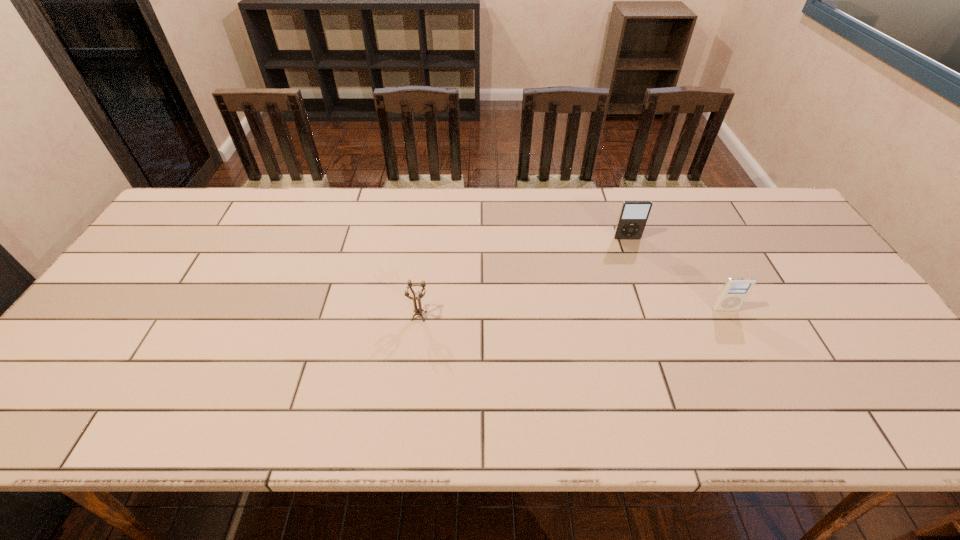
Locate an element on the screen. the left iPod is located at coordinates (633, 216).

The width and height of the screenshot is (960, 540). I want to click on the farthest object, so click(x=633, y=216).

Locate an element on the screen. candle holder is located at coordinates (418, 311).

You are a GUI agent. You are given a task and a screenshot of the screen. Output one action in this format:
    pyautogui.click(x=<x>, y=<y>)
    Task: Click on the shorter iPod
    
    Given the screenshot: What is the action you would take?
    pyautogui.click(x=734, y=292)

Image resolution: width=960 pixels, height=540 pixels. Find the location of `the rightmost object`. the rightmost object is located at coordinates (734, 292).

You are a GUI agent. You are given a task and a screenshot of the screen. Output one action in this format:
    pyautogui.click(x=<x>, y=<y>)
    Task: Click on the free space located 0.310m on the front-facing side of the farthest object
    
    Given the screenshot: What is the action you would take?
    pyautogui.click(x=656, y=321)

Identify the location of vacant space positioned on the front of the leftmost object. This screenshot has height=540, width=960. (416, 343).

Image resolution: width=960 pixels, height=540 pixels. I want to click on vacant space located 0.080m on the front-facing side of the rightmost object, so click(738, 336).

Find the location of `vacant space at the far edge of the desktop`. vacant space at the far edge of the desktop is located at coordinates (547, 205).

In the image, there is a desktop. Where is `vacant space at the near edge`? This screenshot has width=960, height=540. vacant space at the near edge is located at coordinates (120, 404).